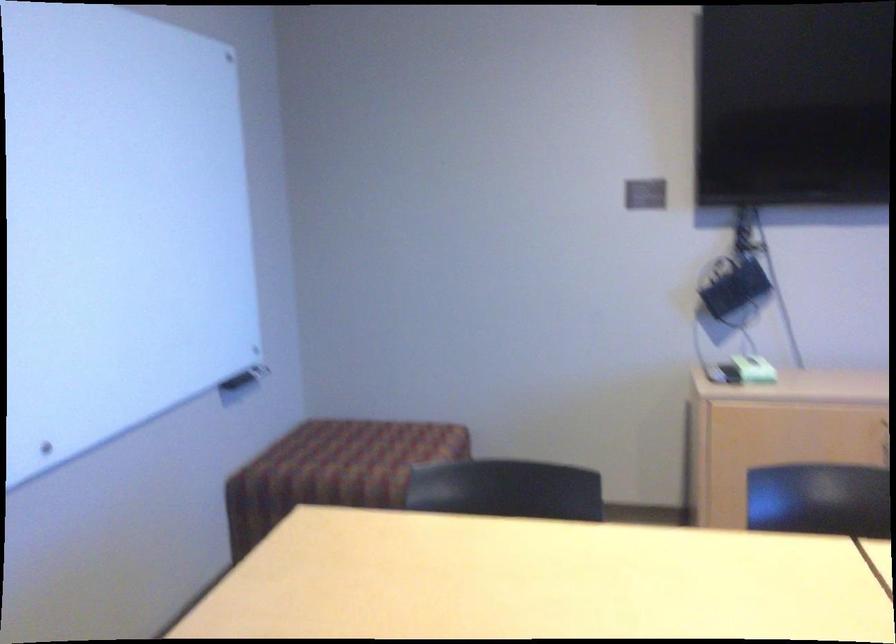
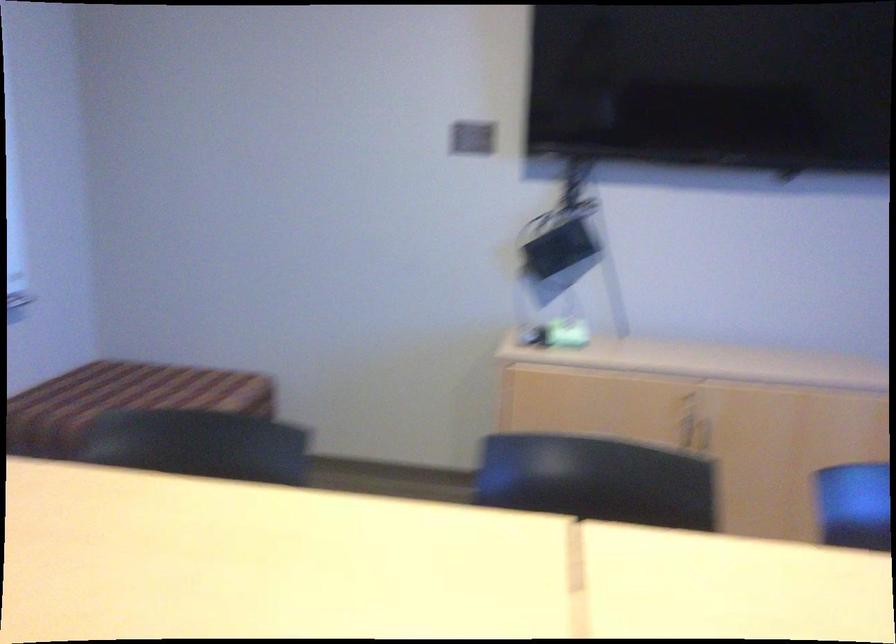
Question: The camera is either moving clockwise (left) or counter-clockwise (right) around the object. The first image is from the beginning of the video and the second image is from the end. Is the camera moving left or right when shooting the video?

Choices:
 (A) Left
 (B) Right

Answer: (A)